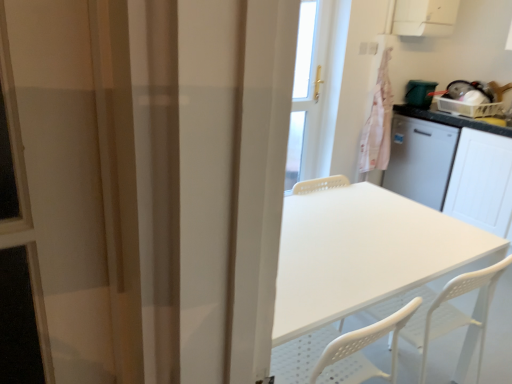
The image size is (512, 384). I want to click on white glossy countertop at right, so click(453, 167).

What are the coordinates of `white matte cabinet at right` in the screenshot? It's located at (481, 182).

This screenshot has height=384, width=512. What are the coordinates of `green plastic bin at right` in the screenshot? It's located at (420, 93).

This screenshot has width=512, height=384. Identify the location of white glossy countertop at right. (453, 167).

From the image's perspective, who appears lower, white plastic table at center or white glossy countertop at right?

white plastic table at center.

At what (x,y) coordinates should I click in order to perform the action: click on table beneath the white glossy countertop at right (from a real-world perspective). Please return your answer as a coordinate pair (x, y). This screenshot has height=384, width=512. Looking at the image, I should click on (362, 253).

Which of these two, white plastic table at center or white glossy countertop at right, is wider?

With larger width is white glossy countertop at right.

Is white plastic table at center taller than green plastic bin at right?

Yes.

Based on the photo, is white plastic table at center not inside green plastic bin at right?

Yes, white plastic table at center is not within green plastic bin at right.

Looking at the image, does white plastic table at center seem bigger or smaller compared to green plastic bin at right?

white plastic table at center is bigger than green plastic bin at right.

In the scene shown: From the image's perspective, would you say white plastic table at center is shown under green plastic bin at right?

Yes, from the image's perspective, white plastic table at center is below green plastic bin at right.

From the picture: In terms of height, does white matte cabinet at right look taller or shorter compared to white glossy countertop at right?

In the image, white matte cabinet at right appears to be taller than white glossy countertop at right.

Which is behind, white matte cabinet at right or white glossy countertop at right?

Positioned behind is white glossy countertop at right.

Is white matte cabinet at right looking in the opposite direction of white glossy countertop at right?

No, white matte cabinet at right is not facing away from white glossy countertop at right.

Are white matte cabinet at right and white glossy countertop at right far apart?

white matte cabinet at right is actually quite close to white glossy countertop at right.

Is white matte cabinet at right smaller than white plastic exhaust hood at upper right?

No, white matte cabinet at right is not smaller than white plastic exhaust hood at upper right.

Would you say white plastic exhaust hood at upper right is part of white matte cabinet at right's contents?

No, white plastic exhaust hood at upper right is not surrounded by white matte cabinet at right.

At what (x,y) coordinates should I click in order to perform the action: click on exhaust hood behind the white matte cabinet at right. Please return your answer as a coordinate pair (x, y). The image size is (512, 384). Looking at the image, I should click on (424, 17).

Which is in front, point (398, 22) or point (295, 277)?

Point (295, 277)

Based on the photo, is white plastic exhaust hood at upper right far from white plastic table at center?

white plastic exhaust hood at upper right is positioned a significant distance from white plastic table at center.

Considering the relative sizes of white plastic exhaust hood at upper right and white plastic table at center in the image provided, is white plastic exhaust hood at upper right shorter than white plastic table at center?

Yes, white plastic exhaust hood at upper right is shorter than white plastic table at center.

Is white plastic exhaust hood at upper right inside or outside of white plastic table at center?

white plastic exhaust hood at upper right lies outside white plastic table at center.

Considering the positions of point (368, 129) and point (438, 14), is point (368, 129) closer or farther from the camera than point (438, 14)?

Point (368, 129).

Between pink fabric laundry at upper right and white plastic exhaust hood at upper right, which one appears on the right side from the viewer's perspective?

Positioned to the right is white plastic exhaust hood at upper right.

Is pink fabric laundry at upper right surrounding white plastic exhaust hood at upper right?

That's incorrect, white plastic exhaust hood at upper right is not inside pink fabric laundry at upper right.

Is white glossy countertop at right directly adjacent to white plastic table at center?

No.

From the picture: From the image's perspective, is white glossy countertop at right positioned above or below white plastic table at center?

Based on their image positions, white glossy countertop at right is located above white plastic table at center.

Could you tell me if white glossy countertop at right is facing white plastic table at center?

No, white glossy countertop at right is not facing towards white plastic table at center.

Visually, is white glossy countertop at right positioned to the left or to the right of white plastic table at center?

In the image, white glossy countertop at right appears on the right side of white plastic table at center.

The width and height of the screenshot is (512, 384). I want to click on counter above the white plastic table at center (from the image's perspective), so click(453, 167).

You are a GUI agent. You are given a task and a screenshot of the screen. Output one action in this format:
    pyautogui.click(x=<x>, y=<y>)
    Task: Click on the appliance positioned vertically above the white plastic table at center (from a real-world perspective)
    This screenshot has height=384, width=512.
    Given the screenshot: What is the action you would take?
    pyautogui.click(x=420, y=93)

Considering their positions, is white glossy countertop at right positioned closer to white matte cabinet at right than green plastic bin at right?

white glossy countertop at right is closer to white matte cabinet at right.

Which object lies further to the anchor point white matte cabinet at right, pink fabric laundry at upper right or white plastic table at center?

white plastic table at center.

When comparing their distances from green plastic bin at right, does white matte cabinet at right or white plastic exhaust hood at upper right seem closer?

The object closer to green plastic bin at right is white plastic exhaust hood at upper right.

From the image, which object appears to be nearer to white matte cabinet at right, green plastic bin at right or pink fabric laundry at upper right?

Based on the image, green plastic bin at right appears to be nearer to white matte cabinet at right.

Looking at the image, which one is located closer to white glossy countertop at right, white plastic table at center or white plastic exhaust hood at upper right?

Based on the image, white plastic exhaust hood at upper right appears to be nearer to white glossy countertop at right.

When comparing their distances from white matte cabinet at right, does white plastic exhaust hood at upper right or green plastic bin at right seem further?

Based on the image, white plastic exhaust hood at upper right appears to be further to white matte cabinet at right.

Looking at the image, which one is located closer to white glossy countertop at right, white plastic table at center or white matte cabinet at right?

Among the two, white matte cabinet at right is located nearer to white glossy countertop at right.

Considering their positions, is white plastic table at center positioned further to pink fabric laundry at upper right than white glossy countertop at right?

The object further to pink fabric laundry at upper right is white plastic table at center.

You are a GUI agent. You are given a task and a screenshot of the screen. Output one action in this format:
    pyautogui.click(x=<x>, y=<y>)
    Task: Click on the laundry between white plastic exhaust hood at upper right and white matte cabinet at right vertically
    
    Given the screenshot: What is the action you would take?
    pyautogui.click(x=378, y=122)

Locate an element on the screen. The height and width of the screenshot is (384, 512). screen door between white plastic exhaust hood at upper right and white plastic table at center in the up-down direction is located at coordinates (481, 182).

Find the location of a particular element. This screenshot has width=512, height=384. laundry positioned between white plastic table at center and green plastic bin at right from near to far is located at coordinates (378, 122).

Locate an element on the screen. Image resolution: width=512 pixels, height=384 pixels. counter between white plastic table at center and green plastic bin at right in the front-back direction is located at coordinates (453, 167).